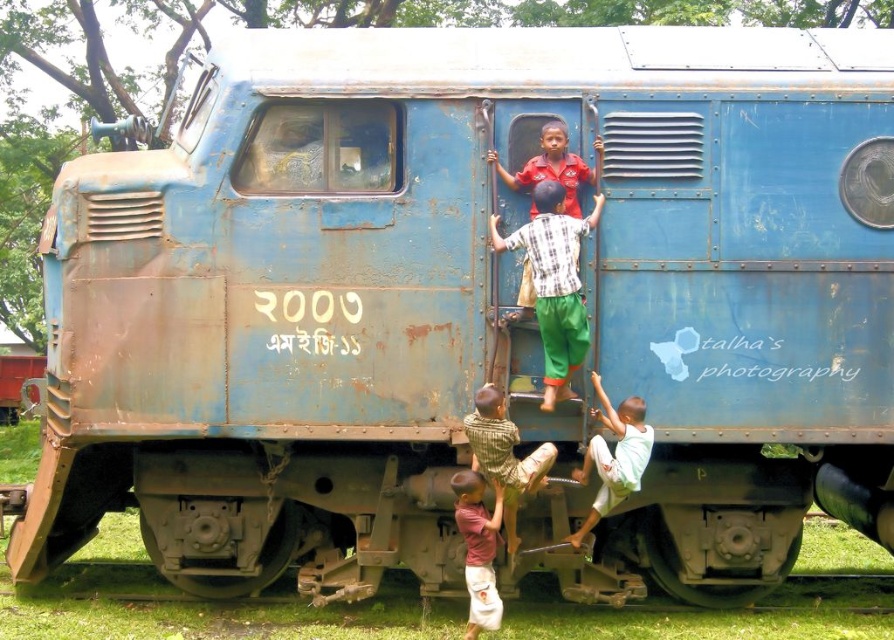
Is point (457, 472) positioned after point (578, 176)?

Yes, point (457, 472) is farther from viewer.

Is matte pink shirt at lower center smaller than matte red shirt at center?

Incorrect, matte pink shirt at lower center is not smaller in size than matte red shirt at center.

Identify the location of matte pink shirt at lower center. The image size is (894, 640). (478, 548).

Can you confirm if checkered fabric shirt at center is thinner than matte red shirt at center?

Yes.

Is checkered fabric shirt at center to the left of matte red shirt at center from the viewer's perspective?

No, checkered fabric shirt at center is not to the left of matte red shirt at center.

Is point (554, 257) positioned before point (572, 157)?

Yes, it is.

Where is `checkered fabric shirt at center`? checkered fabric shirt at center is located at coordinates (554, 282).

Does striped cotton shirt at lower center have a larger size compared to matte red shirt at center?

Yes.

Does striped cotton shirt at lower center appear over matte red shirt at center?

Incorrect, striped cotton shirt at lower center is not positioned above matte red shirt at center.

Between point (513, 468) and point (536, 209), which one is positioned in front?

Point (513, 468)

Locate an element on the screen. striped cotton shirt at lower center is located at coordinates (504, 456).